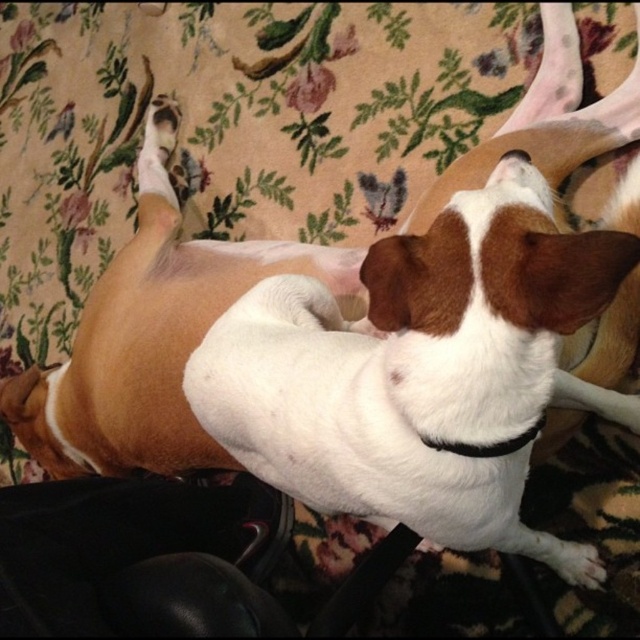
You are a dog owner who wants to ensure your dog stays comfortable. The white fur dog at center is lying on a floral fabric surface. Is the black fabric neckband at center currently covering any part of the dog?

The white fur dog at center is positioned under the black fabric neckband at center, so the neckband is covering part of the dog.

You are looking at the image of a dog lying on a patterned fabric. The dog is at the center. There is a point marked at coordinates point (420, 371). What does this point correspond to?

The point (420, 371) corresponds to the white fur dog at center.

You are a pet owner trying to fit a new dog bed for the white fur dog at center and the black fabric neckband at center. Based on their sizes, which one requires a larger bed?

The white fur dog at center requires a larger bed because its width is greater than the black fabric neckband at center.